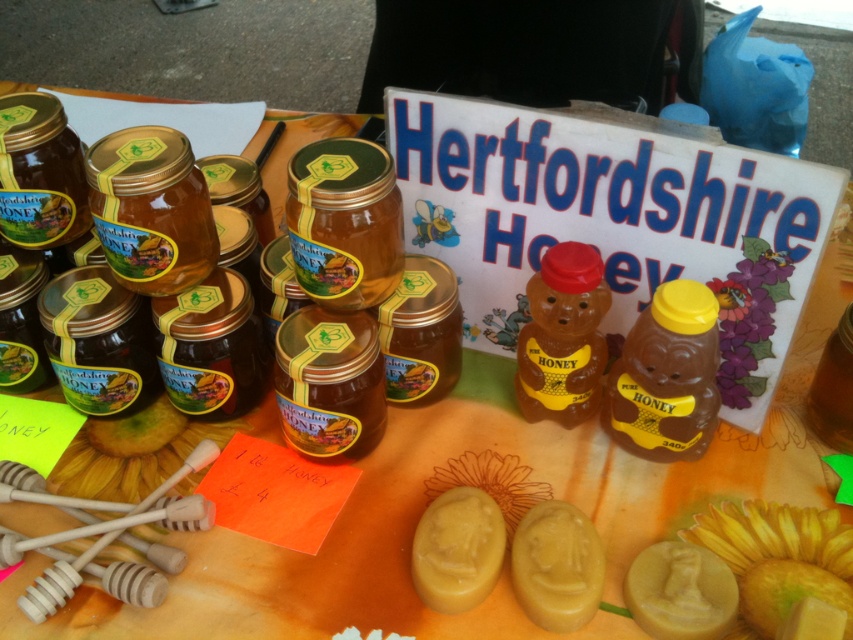
Does yellow matte soap at center appear on the left side of yellow matte honeycomb at center?

In fact, yellow matte soap at center is to the right of yellow matte honeycomb at center.

Can you confirm if yellow matte soap at center is thinner than yellow matte honeycomb at center?

Yes.

Which is behind, point (554, 592) or point (473, 595)?

The point (473, 595) is behind.

This screenshot has height=640, width=853. I want to click on yellow matte soap at center, so click(x=556, y=566).

Who is more forward, (569,627) or (706,596)?

Point (569,627)

At what (x,y) coordinates should I click in order to perform the action: click on yellow matte soap at center. Please return your answer as a coordinate pair (x, y). This screenshot has width=853, height=640. Looking at the image, I should click on (556, 566).

Is yellow matte honeycomb at center thinner than yellow matte honey soap at center?

Indeed, yellow matte honeycomb at center has a lesser width compared to yellow matte honey soap at center.

The width and height of the screenshot is (853, 640). Describe the element at coordinates (457, 548) in the screenshot. I see `yellow matte honeycomb at center` at that location.

Image resolution: width=853 pixels, height=640 pixels. What do you see at coordinates (457, 548) in the screenshot?
I see `yellow matte honeycomb at center` at bounding box center [457, 548].

Identify the location of yellow matte honeycomb at center. The width and height of the screenshot is (853, 640). (457, 548).